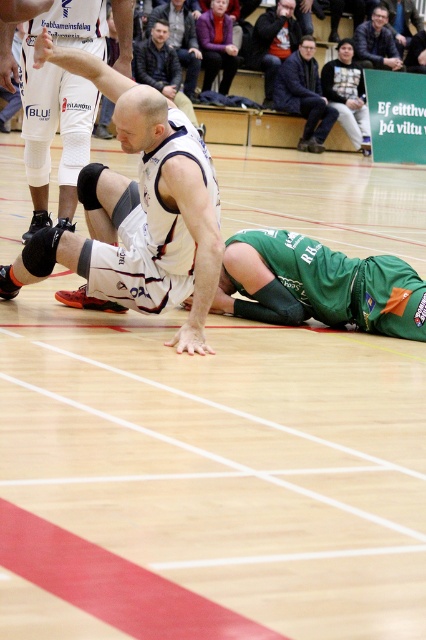
Question: Is white matte basketball player at center thinner than matte white jersey at center?

Choices:
 (A) no
 (B) yes

Answer: (B)

Question: Among these objects, which one is nearest to the camera?

Choices:
 (A) white jersey at center
 (B) dark gray jacket at upper center

Answer: (A)

Question: Is white matte basketball jersey at center to the left of white matte basketball player at center from the viewer's perspective?

Choices:
 (A) no
 (B) yes

Answer: (A)

Question: Which point is closer to the camera?

Choices:
 (A) dark blue jacket at upper center
 (B) dark blue textured jacket at upper right
 (C) white matte basketball jersey at center

Answer: (C)

Question: From the image, what is the correct spatial relationship of white jersey at center in relation to matte white jersey at center?

Choices:
 (A) below
 (B) above

Answer: (A)

Question: Which point is farther to the camera?

Choices:
 (A) dark blue jacket at upper center
 (B) white matte basketball player at center

Answer: (A)